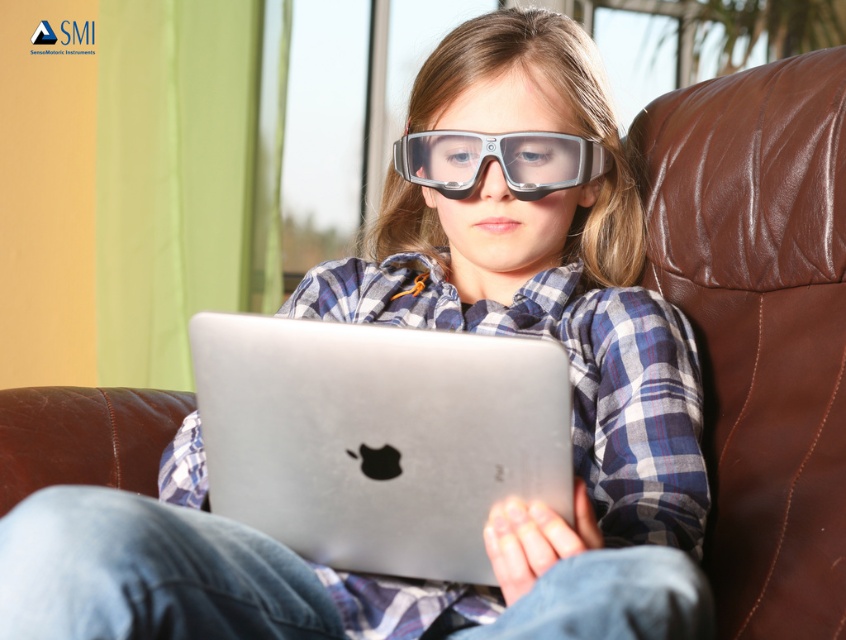
In the scene shown: You are trying to place both the silver metallic laptop at center and the transparent plastic goggles at center into a rectangular box. The box can only fit items with a combined width of 40 cm. If the laptop is wider than the goggles, what is the minimum width the box must have to accommodate both items?

The silver metallic laptop at center is wider than the transparent plastic goggles at center. Since the box must fit both items, the minimum width required would be the sum of their individual widths. However, without knowing the exact widths, we can only state that the box must be wider than the width of the laptop alone. Since the laptop is wider, the minimum width needed is just over the laptop width, but at least greater than the laptop width.

You are a delivery person who needs to place a box on the surface between the silver metallic laptop at center and the transparent plastic goggles at center. Can you fit the box there?

The silver metallic laptop at center is in front of the transparent plastic goggles at center, so there is no space between them for the box to be placed.

You are a delivery person who needs to place a small package on either the silver metallic laptop at center or the transparent plastic goggles at center. Which object should you choose to avoid damaging the package?

You should place the package on the silver metallic laptop at center because it is below the transparent plastic goggles at center, making it a more stable surface.